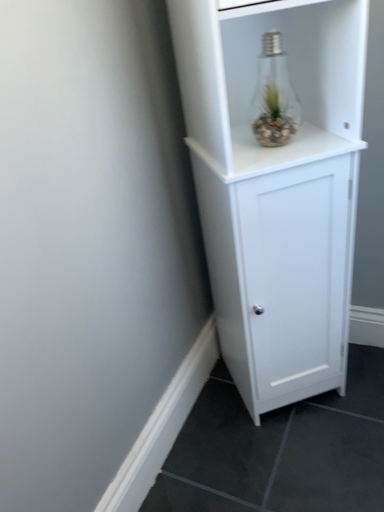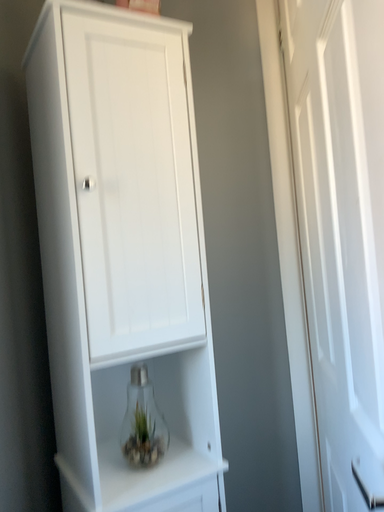
Question: Which way did the camera rotate in the video?

Choices:
 (A) rotated upward
 (B) rotated downward

Answer: (A)